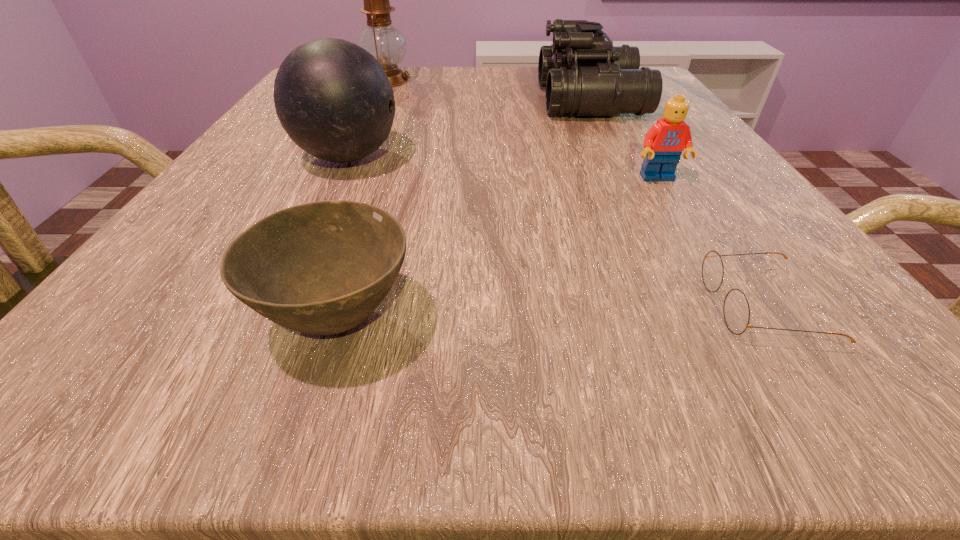
Where is `oil lamp located in the left edge section of the desktop`? The image size is (960, 540). oil lamp located in the left edge section of the desktop is located at coordinates (386, 43).

I want to click on bowling ball that is positioned at the left edge, so click(334, 100).

You are a GUI agent. You are given a task and a screenshot of the screen. Output one action in this format:
    pyautogui.click(x=<x>, y=<y>)
    Task: Click on the bowl positioned at the left edge
    
    Given the screenshot: What is the action you would take?
    pyautogui.click(x=321, y=268)

Identify the location of binoculars located at the right edge. (584, 74).

Where is `Lego present at the right edge`? This screenshot has height=540, width=960. Lego present at the right edge is located at coordinates (664, 142).

What are the coordinates of `spectacles that is at the right edge` in the screenshot? It's located at (736, 310).

The width and height of the screenshot is (960, 540). Find the location of `object present at the far left corner`. object present at the far left corner is located at coordinates (386, 43).

Where is `object at the near left corner`? Image resolution: width=960 pixels, height=540 pixels. object at the near left corner is located at coordinates (x=321, y=268).

Locate an element on the screen. object that is at the far right corner is located at coordinates (584, 74).

Find the location of a particular element. This screenshot has height=540, width=960. object present at the near right corner is located at coordinates (736, 310).